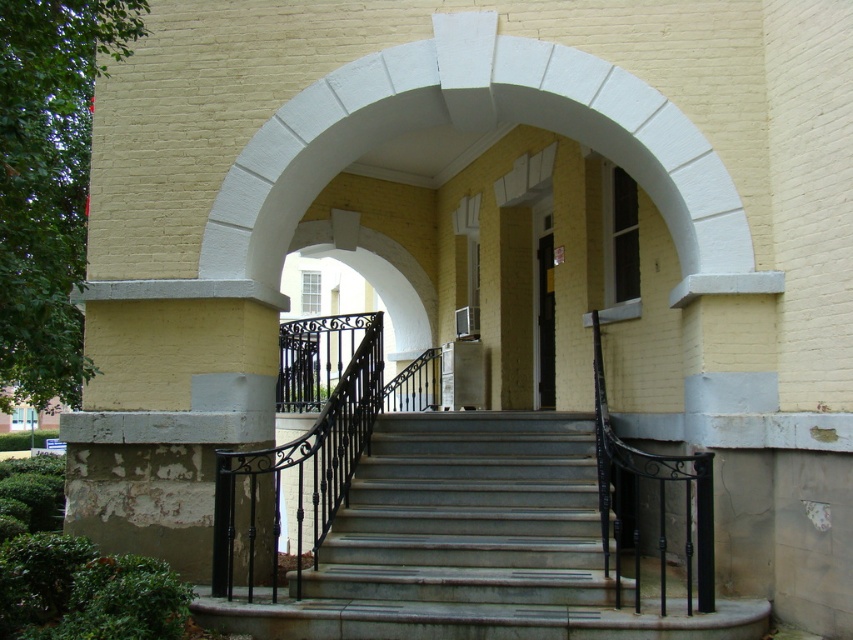
Question: Is gray concrete stairs at center above black glass door at center?

Choices:
 (A) yes
 (B) no

Answer: (B)

Question: Which of the following is the closest to the observer?

Choices:
 (A) black glass door at center
 (B) gray concrete stairs at center

Answer: (B)

Question: Does gray concrete stairs at center appear on the left side of black glass door at center?

Choices:
 (A) no
 (B) yes

Answer: (B)

Question: Is gray concrete stairs at center to the right of black glass door at center from the viewer's perspective?

Choices:
 (A) yes
 (B) no

Answer: (B)